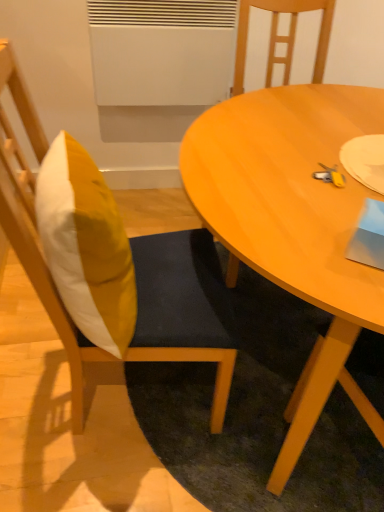
This screenshot has width=384, height=512. I want to click on wooden chair at left, which appears as the first chair when viewed from the left, so click(184, 308).

Locate an element on the screen. The height and width of the screenshot is (512, 384). yellow fabric pillow at left is located at coordinates (86, 246).

In order to face light brown wooden table at center, should I rotate leftwards or rightwards?

You should look right and rotate roughly 19.524 degrees.

What is the approximate width of light brown wooden table at center?

light brown wooden table at center is 3.38 feet wide.

The height and width of the screenshot is (512, 384). I want to click on wooden chair at left, which appears as the first chair when viewed from the left, so (x=184, y=308).

In order to click on the 2nd chair counting from the left of the light brown wooden table at center in this screenshot , I will do `click(184, 308)`.

Does wooden chair at left, which appears as the first chair when viewed from the left, appear on the left side of light brown wooden table at center?

Indeed, wooden chair at left, which appears as the first chair when viewed from the left, is positioned on the left side of light brown wooden table at center.

Are wooden chair at left, acting as the second chair starting from the right, and light brown wooden table at center located far from each other?

They are positioned close to each other.

Is wooden chair at left, which appears as the first chair when viewed from the left, further to camera compared to light brown wooden table at center?

Yes, wooden chair at left, which appears as the first chair when viewed from the left, is further from the camera.

In the scene shown: Is light brown wooden table at center completely or partially inside wooden chair at center, the second chair positioned from the left?

No, wooden chair at center, the second chair positioned from the left, does not contain light brown wooden table at center.

From a real-world perspective, is wooden chair at center, which is the 1th chair in right-to-left order, located higher than light brown wooden table at center?

Yes, from a real-world perspective, wooden chair at center, which is the 1th chair in right-to-left order, is above light brown wooden table at center.

Starting from the light brown wooden table at center, which chair is the 2nd one behind? Please provide its 2D coordinates.

[(282, 37)]

In the scene shown: Is wooden chair at center, the second chair positioned from the left, smaller than light brown wooden table at center?

Indeed, wooden chair at center, the second chair positioned from the left, has a smaller size compared to light brown wooden table at center.

Considering the relative sizes of yellow fabric pillow at left and wooden chair at left, which appears as the first chair when viewed from the left, in the image provided, is yellow fabric pillow at left wider than wooden chair at left, which appears as the first chair when viewed from the left,?

No, yellow fabric pillow at left is not wider than wooden chair at left, which appears as the first chair when viewed from the left.

From a real-world perspective, is yellow fabric pillow at left located beneath wooden chair at left, acting as the second chair starting from the right?

No, from a real-world perspective, yellow fabric pillow at left is not beneath wooden chair at left, acting as the second chair starting from the right.

Is point (126, 337) farther from viewer compared to point (215, 403)?

No, it is not.

How different are the orientations of wooden chair at left, acting as the second chair starting from the right, and wooden chair at center, the second chair positioned from the left, in degrees?

They differ by 86.9 degrees in their facing directions.

Which of these two, wooden chair at left, which appears as the first chair when viewed from the left, or wooden chair at center, the second chair positioned from the left, stands shorter?

wooden chair at center, the second chair positioned from the left.

Does wooden chair at left, acting as the second chair starting from the right, have a greater width compared to wooden chair at center, the second chair positioned from the left?

In fact, wooden chair at left, acting as the second chair starting from the right, might be narrower than wooden chair at center, the second chair positioned from the left.

From a real-world perspective, between wooden chair at left, acting as the second chair starting from the right, and wooden chair at center, which is the 1th chair in right-to-left order, who is vertically lower?

wooden chair at center, which is the 1th chair in right-to-left order, is physically lower.

Is light brown wooden table at center smaller than wooden chair at center, the second chair positioned from the left?

No, light brown wooden table at center is not smaller than wooden chair at center, the second chair positioned from the left.

Are light brown wooden table at center and wooden chair at center, the second chair positioned from the left, far apart?

They are positioned close to each other.

Considering the positions of points (298, 228) and (244, 62), is point (298, 228) closer to camera compared to point (244, 62)?

Yes.

You are a GUI agent. You are given a task and a screenshot of the screen. Output one action in this format:
    pyautogui.click(x=<x>, y=<y>)
    Task: Click on the 2nd chair behind the light brown wooden table at center, counting from the anchor's position
    Image resolution: width=384 pixels, height=512 pixels.
    Given the screenshot: What is the action you would take?
    pyautogui.click(x=282, y=37)

Is point (119, 242) closer to camera compared to point (287, 84)?

Yes, point (119, 242) is in front of point (287, 84).

Is yellow fabric pillow at left outside of wooden chair at center, which is the 1th chair in right-to-left order?

yellow fabric pillow at left is positioned outside wooden chair at center, which is the 1th chair in right-to-left order.

Considering the relative sizes of yellow fabric pillow at left and wooden chair at center, the second chair positioned from the left, in the image provided, is yellow fabric pillow at left thinner than wooden chair at center, the second chair positioned from the left,?

Yes, yellow fabric pillow at left is thinner than wooden chair at center, the second chair positioned from the left.

Would you say yellow fabric pillow at left is part of light brown wooden table at center's contents?

That's incorrect, yellow fabric pillow at left is not inside light brown wooden table at center.

Is light brown wooden table at center bigger or smaller than yellow fabric pillow at left?

light brown wooden table at center is bigger than yellow fabric pillow at left.

Which is behind, light brown wooden table at center or yellow fabric pillow at left?

yellow fabric pillow at left is further away from the camera.

Looking at this image, between light brown wooden table at center and yellow fabric pillow at left, which one has smaller width?

yellow fabric pillow at left.

Locate an element on the screen. The image size is (384, 512). coffee table in front of the wooden chair at left, acting as the second chair starting from the right is located at coordinates (294, 223).

From the light brown wooden table at center, count 2nd chairs backward and point to it. Please provide its 2D coordinates.

[(282, 37)]

Based on their spatial positions, is light brown wooden table at center or yellow fabric pillow at left further from wooden chair at center, the second chair positioned from the left?

Among the two, yellow fabric pillow at left is located further to wooden chair at center, the second chair positioned from the left.

Looking at the image, which one is located further to wooden chair at left, acting as the second chair starting from the right, light brown wooden table at center or yellow fabric pillow at left?

light brown wooden table at center lies further to wooden chair at left, acting as the second chair starting from the right, than the other object.

From the image, which object appears to be nearer to yellow fabric pillow at left, wooden chair at left, which appears as the first chair when viewed from the left, or wooden chair at center, the second chair positioned from the left?

wooden chair at left, which appears as the first chair when viewed from the left, lies closer to yellow fabric pillow at left than the other object.

Looking at this image, looking at the image, which one is located closer to light brown wooden table at center, wooden chair at center, which is the 1th chair in right-to-left order, or wooden chair at left, which appears as the first chair when viewed from the left?

Based on the image, wooden chair at left, which appears as the first chair when viewed from the left, appears to be nearer to light brown wooden table at center.

Which object lies further to the anchor point light brown wooden table at center, wooden chair at left, which appears as the first chair when viewed from the left, or yellow fabric pillow at left?

yellow fabric pillow at left lies further to light brown wooden table at center than the other object.

Considering their positions, is light brown wooden table at center positioned further to wooden chair at left, which appears as the first chair when viewed from the left, than wooden chair at center, which is the 1th chair in right-to-left order?

wooden chair at center, which is the 1th chair in right-to-left order, is positioned further to the anchor wooden chair at left, which appears as the first chair when viewed from the left.

Considering their positions, is wooden chair at left, acting as the second chair starting from the right, positioned further to light brown wooden table at center than wooden chair at center, the second chair positioned from the left?

Based on the image, wooden chair at center, the second chair positioned from the left, appears to be further to light brown wooden table at center.

Based on their spatial positions, is light brown wooden table at center or wooden chair at center, the second chair positioned from the left, closer to yellow fabric pillow at left?

Among the two, light brown wooden table at center is located nearer to yellow fabric pillow at left.

At what (x,y) coordinates should I click in order to perform the action: click on chair between yellow fabric pillow at left and wooden chair at center, which is the 1th chair in right-to-left order, from left to right. Please return your answer as a coordinate pair (x, y). The height and width of the screenshot is (512, 384). Looking at the image, I should click on (184, 308).

Where is `chair located between wooden chair at left, which appears as the first chair when viewed from the left, and light brown wooden table at center in the left-right direction`? chair located between wooden chair at left, which appears as the first chair when viewed from the left, and light brown wooden table at center in the left-right direction is located at coordinates (282, 37).